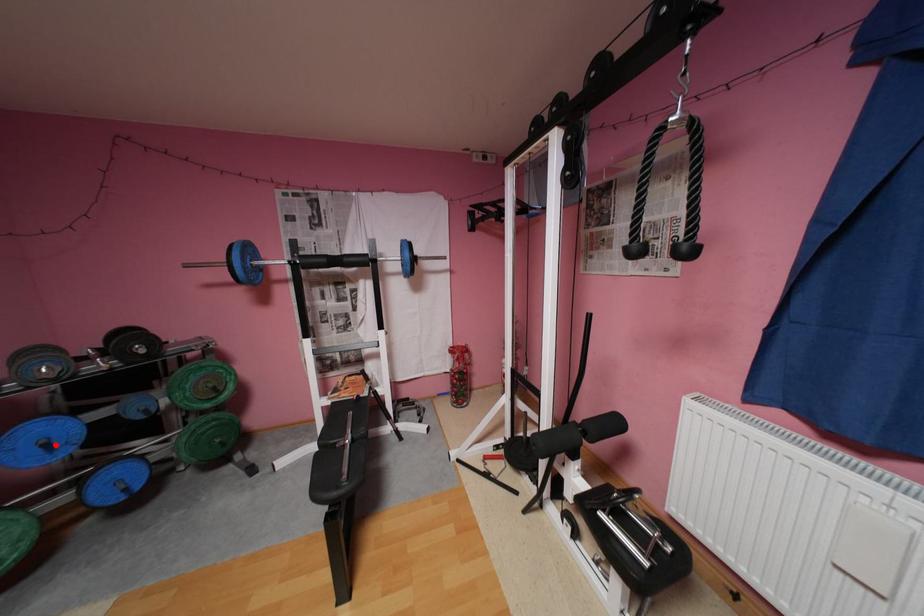
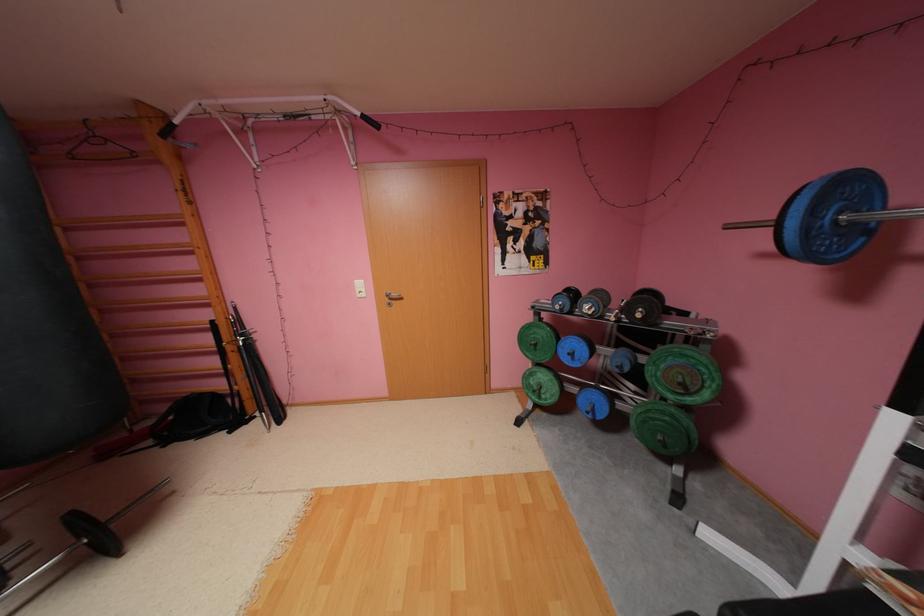
Locate, in the second image, the point that corresponds to the highlighted location in the first image.

(580, 354)